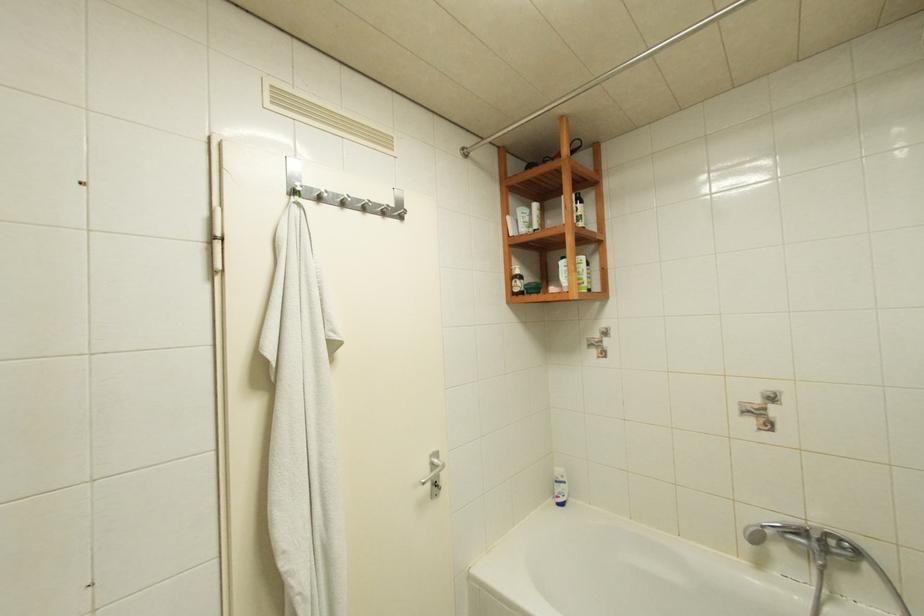
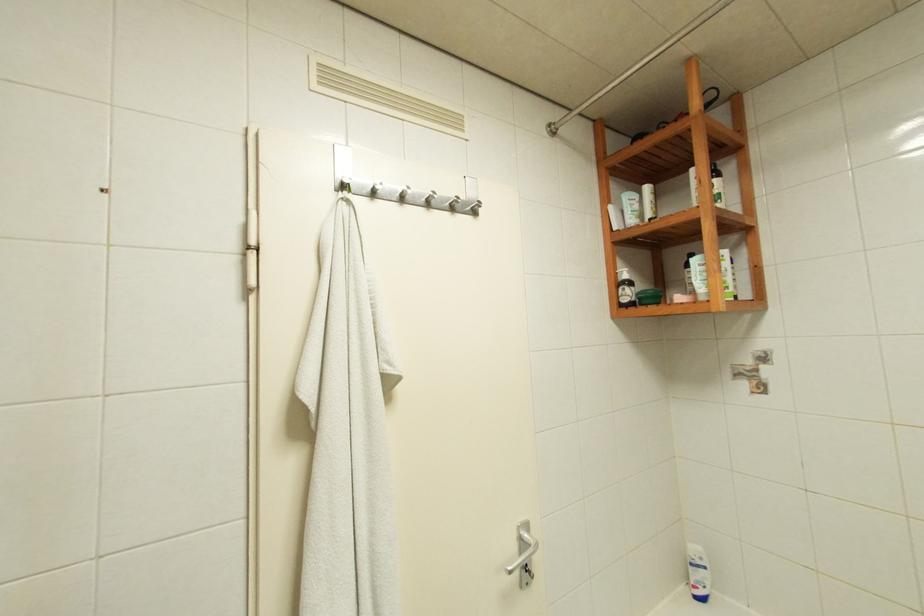
Question: Based on the continuous images, in which direction is the camera rotating? Reply with the corresponding letter.

Choices:
 (A) Left
 (B) Right
 (C) Up
 (D) Down

Answer: (A)